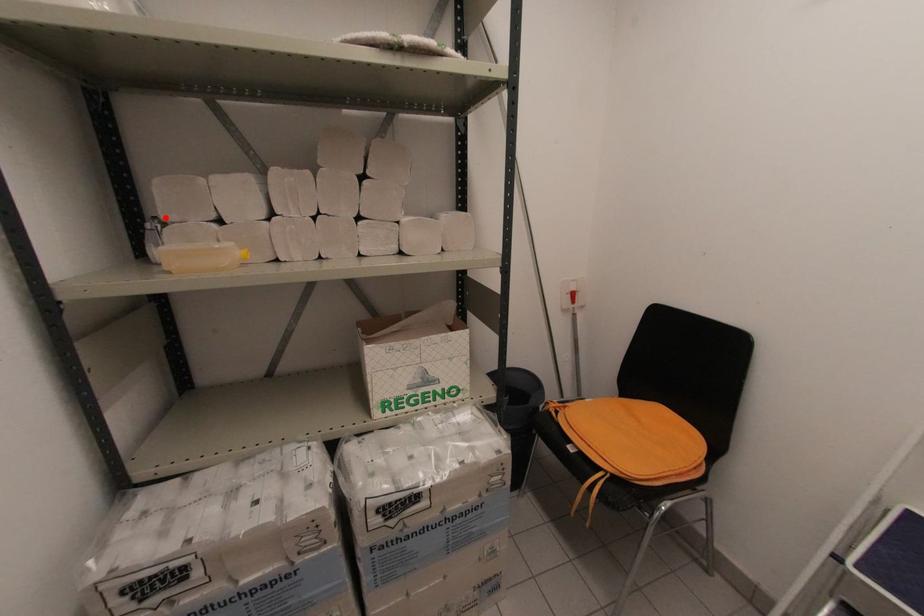
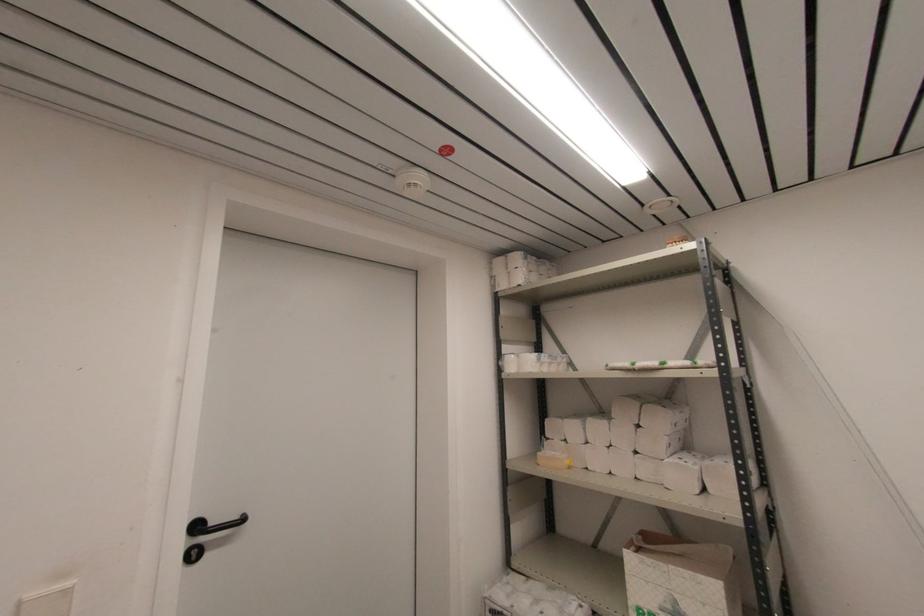
The point at the highlighted location is marked in the first image. Where is the corresponding point in the second image?

(548, 436)